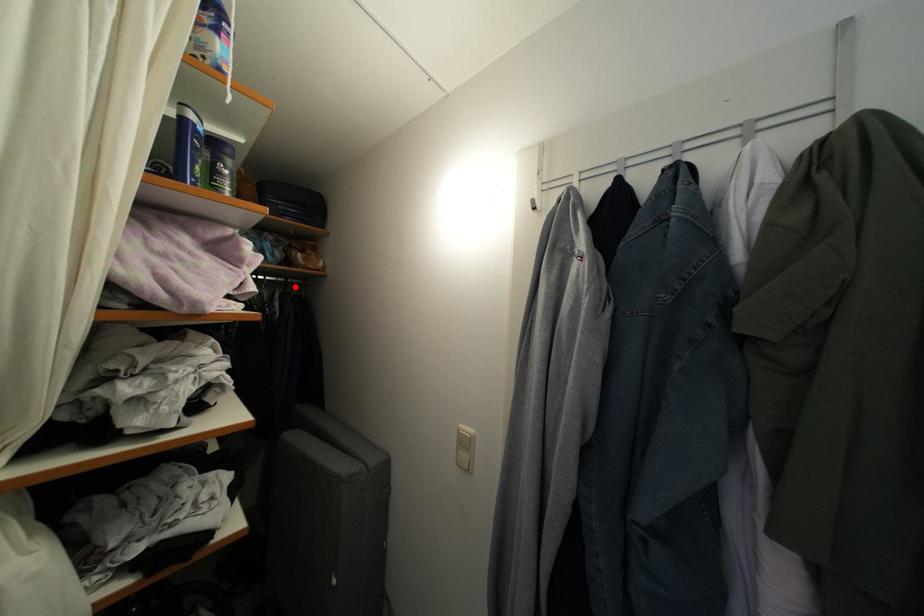
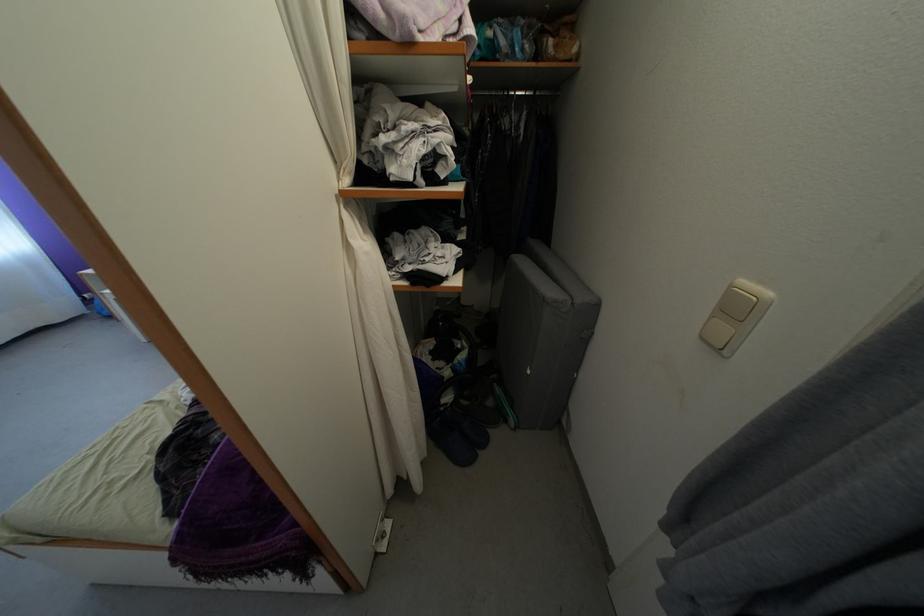
In the second image, find the point that corresponds to the highlighted location in the first image.

(543, 98)